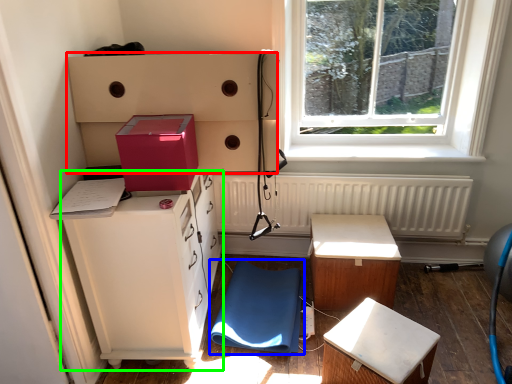
Question: Which is nearer to the shelf (highlighted by a red box)? swivel chair (highlighted by a blue box) or cabinetry (highlighted by a green box).

Choices:
 (A) swivel chair
 (B) cabinetry

Answer: (B)